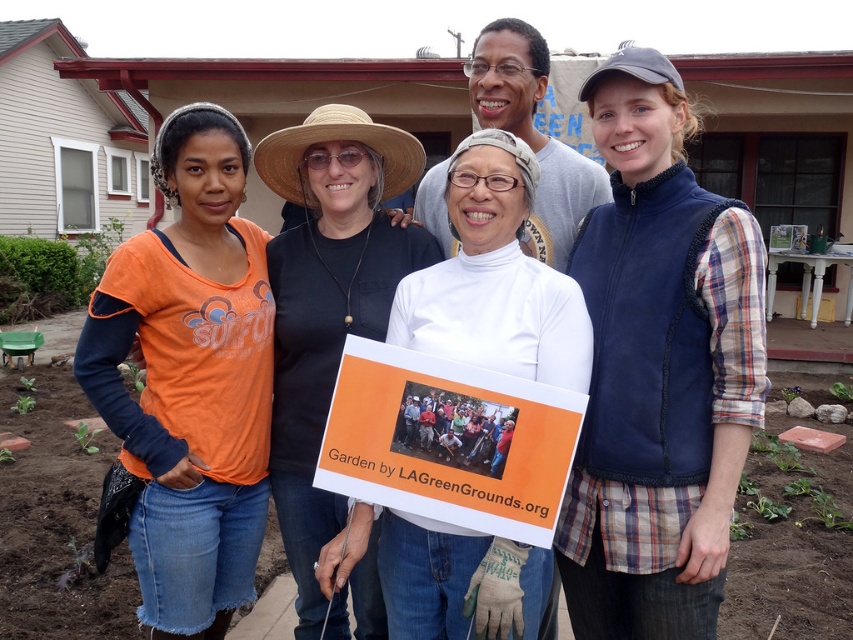
Does navy blue fleece vest at center have a lesser width compared to white matte turtleneck at center?

Indeed, navy blue fleece vest at center has a lesser width compared to white matte turtleneck at center.

Which is in front, point (675, 412) or point (564, 180)?

Point (675, 412) is in front.

Where is `navy blue fleece vest at center`? This screenshot has width=853, height=640. navy blue fleece vest at center is located at coordinates click(x=659, y=371).

Does navy blue fleece vest at center appear on the left side of white paper sign at center?

Incorrect, navy blue fleece vest at center is not on the left side of white paper sign at center.

Is point (611, 76) more distant than point (531, 467)?

That is True.

Image resolution: width=853 pixels, height=640 pixels. What do you see at coordinates (659, 371) in the screenshot? I see `navy blue fleece vest at center` at bounding box center [659, 371].

I want to click on navy blue fleece vest at center, so click(659, 371).

Between orange cotton shirt at left and white paper sign at center, which one appears on the right side from the viewer's perspective?

white paper sign at center

Is point (154, 385) positioned behind point (357, 412)?

Yes.

Locate an element on the screen. The height and width of the screenshot is (640, 853). orange cotton shirt at left is located at coordinates (190, 380).